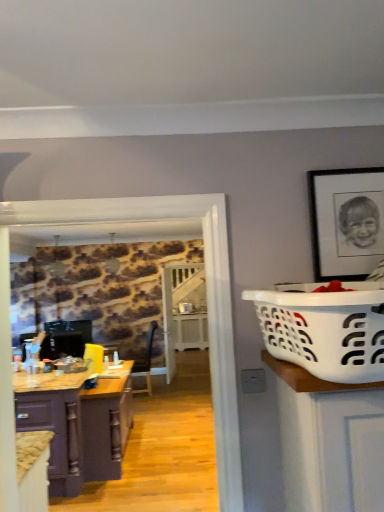
At what (x,y) coordinates should I click in order to perform the action: click on black matte picture frame at upper right. Please return your answer as a coordinate pair (x, y). The image size is (384, 512). Looking at the image, I should click on (346, 222).

What is the approximate width of black matte picture frame at upper right?

black matte picture frame at upper right is 1.32 inches wide.

Image resolution: width=384 pixels, height=512 pixels. Describe the element at coordinates (325, 329) in the screenshot. I see `white plastic laundry basket at right` at that location.

Image resolution: width=384 pixels, height=512 pixels. What do you see at coordinates (33, 469) in the screenshot?
I see `matte purple cabinet at lower left, which is counted as the 1th cabinetry, starting from the front` at bounding box center [33, 469].

What do you see at coordinates (80, 426) in the screenshot?
I see `purple wood cabinet at left, which appears as the second cabinetry when viewed from the front` at bounding box center [80, 426].

I want to click on black matte picture frame at upper right, so click(346, 222).

How different are the orientations of matte purple cabinet at lower left, the 2th cabinetry when ordered from back to front, and white plastic laundry basket at right in degrees?

They differ by 87.9 degrees in their facing directions.

From a real-world perspective, is matte purple cabinet at lower left, the 2th cabinetry when ordered from back to front, positioned above or below white plastic laundry basket at right?

matte purple cabinet at lower left, the 2th cabinetry when ordered from back to front, is situated lower than white plastic laundry basket at right in the real world.

Could you measure the distance between matte purple cabinet at lower left, which is counted as the 1th cabinetry, starting from the front, and white plastic laundry basket at right?

A distance of 5.58 feet exists between matte purple cabinet at lower left, which is counted as the 1th cabinetry, starting from the front, and white plastic laundry basket at right.

Based on the photo, does matte purple cabinet at lower left, the 2th cabinetry when ordered from back to front, have a lesser width compared to white plastic laundry basket at right?

Yes, matte purple cabinet at lower left, the 2th cabinetry when ordered from back to front, is thinner than white plastic laundry basket at right.

Find the location of a particular element. picture frame above the matte purple cabinet at lower left, the 2th cabinetry when ordered from back to front (from the image's perspective) is located at coordinates (346, 222).

From the image's perspective, is black matte picture frame at upper right located above or below matte purple cabinet at lower left, the 2th cabinetry when ordered from back to front?

Clearly, from the image's perspective, black matte picture frame at upper right is above matte purple cabinet at lower left, the 2th cabinetry when ordered from back to front.

Considering the sizes of objects black matte picture frame at upper right and matte purple cabinet at lower left, which is counted as the 1th cabinetry, starting from the front, in the image provided, who is taller, black matte picture frame at upper right or matte purple cabinet at lower left, which is counted as the 1th cabinetry, starting from the front,?

Standing taller between the two is black matte picture frame at upper right.

Which of these two, black matte picture frame at upper right or matte purple cabinet at lower left, which is counted as the 1th cabinetry, starting from the front, is smaller?

black matte picture frame at upper right is smaller.

From the image's perspective, is white plastic laundry basket at right positioned above or below matte purple cabinet at lower left, the 2th cabinetry when ordered from back to front?

white plastic laundry basket at right is above matte purple cabinet at lower left, the 2th cabinetry when ordered from back to front.

Would you say white plastic laundry basket at right is a long distance from matte purple cabinet at lower left, which is counted as the 1th cabinetry, starting from the front?

Indeed, white plastic laundry basket at right is not near matte purple cabinet at lower left, which is counted as the 1th cabinetry, starting from the front.

Does point (328, 300) lie behind point (43, 454)?

No, (328, 300) is in front of (43, 454).

Looking at the image, does black matte picture frame at upper right seem bigger or smaller compared to white plastic laundry basket at right?

black matte picture frame at upper right is smaller than white plastic laundry basket at right.

Does black matte picture frame at upper right turn towards white plastic laundry basket at right?

Yes, black matte picture frame at upper right is aimed at white plastic laundry basket at right.

Image resolution: width=384 pixels, height=512 pixels. Find the location of `picture frame located above the white plastic laundry basket at right (from a real-world perspective)`. picture frame located above the white plastic laundry basket at right (from a real-world perspective) is located at coordinates (346, 222).

Are black matte picture frame at upper right and white plastic laundry basket at right located far from each other?

No, black matte picture frame at upper right is not far from white plastic laundry basket at right.

Find the location of a particular element. The height and width of the screenshot is (512, 384). basket container located in front of the black matte picture frame at upper right is located at coordinates (325, 329).

Can you confirm if white plastic laundry basket at right is positioned to the right of black matte picture frame at upper right?

No, white plastic laundry basket at right is not to the right of black matte picture frame at upper right.

From a real-world perspective, relative to black matte picture frame at upper right, is white plastic laundry basket at right vertically above or below?

Clearly, from a real-world perspective, white plastic laundry basket at right is below black matte picture frame at upper right.

How far apart are white plastic laundry basket at right and black matte picture frame at upper right?

A distance of 18.20 inches exists between white plastic laundry basket at right and black matte picture frame at upper right.

Is purple wood cabinet at left, acting as the 1th cabinetry starting from the back, turned away from white plastic laundry basket at right?

No.

Which object is closer to the camera, purple wood cabinet at left, acting as the 1th cabinetry starting from the back, or white plastic laundry basket at right?

white plastic laundry basket at right.

Between purple wood cabinet at left, which appears as the second cabinetry when viewed from the front, and white plastic laundry basket at right, which one has smaller size?

white plastic laundry basket at right is smaller.

Considering the sizes of objects purple wood cabinet at left, acting as the 1th cabinetry starting from the back, and white plastic laundry basket at right in the image provided, who is wider, purple wood cabinet at left, acting as the 1th cabinetry starting from the back, or white plastic laundry basket at right?

Wider between the two is purple wood cabinet at left, acting as the 1th cabinetry starting from the back.

Which of these two, black matte picture frame at upper right or purple wood cabinet at left, which appears as the second cabinetry when viewed from the front, is wider?

Result: purple wood cabinet at left, which appears as the second cabinetry when viewed from the front, is wider.

Which object is positioned more to the left, black matte picture frame at upper right or purple wood cabinet at left, which appears as the second cabinetry when viewed from the front?

purple wood cabinet at left, which appears as the second cabinetry when viewed from the front.

Which of these two, black matte picture frame at upper right or purple wood cabinet at left, which appears as the second cabinetry when viewed from the front, is bigger?

Bigger between the two is purple wood cabinet at left, which appears as the second cabinetry when viewed from the front.

Is black matte picture frame at upper right facing towards purple wood cabinet at left, acting as the 1th cabinetry starting from the back?

No.

Find the location of a particular element. the 1st cabinetry behind the white plastic laundry basket at right, starting your count from the anchor is located at coordinates (33, 469).

At what (x,y) coordinates should I click in order to perform the action: click on picture frame in front of the matte purple cabinet at lower left, which is counted as the 1th cabinetry, starting from the front. Please return your answer as a coordinate pair (x, y). Looking at the image, I should click on [346, 222].

Estimate the real-world distances between objects in this image. Which object is further from black matte picture frame at upper right, white plastic laundry basket at right or purple wood cabinet at left, which appears as the second cabinetry when viewed from the front?

purple wood cabinet at left, which appears as the second cabinetry when viewed from the front, lies further to black matte picture frame at upper right than the other object.

Based on their spatial positions, is black matte picture frame at upper right or purple wood cabinet at left, acting as the 1th cabinetry starting from the back, further from white plastic laundry basket at right?

The object further to white plastic laundry basket at right is purple wood cabinet at left, acting as the 1th cabinetry starting from the back.

From the image, which object appears to be farther from black matte picture frame at upper right, purple wood cabinet at left, acting as the 1th cabinetry starting from the back, or white plastic laundry basket at right?

purple wood cabinet at left, acting as the 1th cabinetry starting from the back, is further to black matte picture frame at upper right.

In the scene shown: Considering their positions, is purple wood cabinet at left, acting as the 1th cabinetry starting from the back, positioned further to matte purple cabinet at lower left, the 2th cabinetry when ordered from back to front, than black matte picture frame at upper right?

black matte picture frame at upper right lies further to matte purple cabinet at lower left, the 2th cabinetry when ordered from back to front, than the other object.

Based on their spatial positions, is matte purple cabinet at lower left, the 2th cabinetry when ordered from back to front, or white plastic laundry basket at right closer to black matte picture frame at upper right?

The object closer to black matte picture frame at upper right is white plastic laundry basket at right.

Which object lies nearer to the anchor point purple wood cabinet at left, which appears as the second cabinetry when viewed from the front, matte purple cabinet at lower left, which is counted as the 1th cabinetry, starting from the front, or white plastic laundry basket at right?

Based on the image, matte purple cabinet at lower left, which is counted as the 1th cabinetry, starting from the front, appears to be nearer to purple wood cabinet at left, which appears as the second cabinetry when viewed from the front.

Looking at the image, which one is located closer to black matte picture frame at upper right, white plastic laundry basket at right or matte purple cabinet at lower left, which is counted as the 1th cabinetry, starting from the front?

Based on the image, white plastic laundry basket at right appears to be nearer to black matte picture frame at upper right.

From the image, which object appears to be nearer to matte purple cabinet at lower left, which is counted as the 1th cabinetry, starting from the front, black matte picture frame at upper right or purple wood cabinet at left, acting as the 1th cabinetry starting from the back?

purple wood cabinet at left, acting as the 1th cabinetry starting from the back, is closer to matte purple cabinet at lower left, which is counted as the 1th cabinetry, starting from the front.

Where is `basket container between matte purple cabinet at lower left, the 2th cabinetry when ordered from back to front, and black matte picture frame at upper right, in the horizontal direction`? This screenshot has width=384, height=512. basket container between matte purple cabinet at lower left, the 2th cabinetry when ordered from back to front, and black matte picture frame at upper right, in the horizontal direction is located at coordinates (325, 329).

Locate an element on the screen. picture frame located between white plastic laundry basket at right and purple wood cabinet at left, acting as the 1th cabinetry starting from the back, in the depth direction is located at coordinates (346, 222).

The width and height of the screenshot is (384, 512). I want to click on cabinetry positioned between black matte picture frame at upper right and purple wood cabinet at left, acting as the 1th cabinetry starting from the back, from near to far, so click(x=33, y=469).

You are a GUI agent. You are given a task and a screenshot of the screen. Output one action in this format:
    pyautogui.click(x=<x>, y=<y>)
    Task: Click on the cabinetry between white plastic laundry basket at right and purple wood cabinet at left, acting as the 1th cabinetry starting from the back, from front to back
    This screenshot has height=512, width=384.
    Given the screenshot: What is the action you would take?
    pyautogui.click(x=33, y=469)